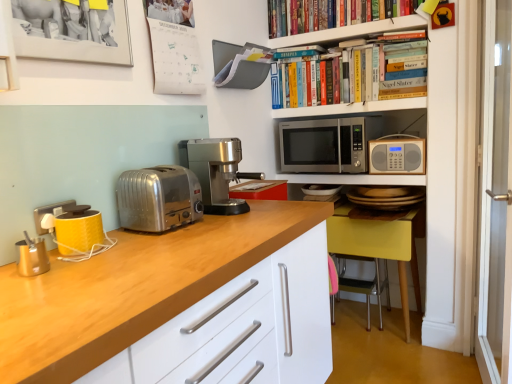
What is the approximate width of stainless steel microwave at upper center?

It is 20.81 inches.

Measure the distance between hardcover books at upper center, positioned as the second shelf in bottom-to-top order, and camera.

They are 2.14 meters apart.

What do you see at coordinates (351, 108) in the screenshot?
I see `hardcover books at upper center, the 1th shelf ordered from the bottom` at bounding box center [351, 108].

You are a GUI agent. You are given a task and a screenshot of the screen. Output one action in this format:
    pyautogui.click(x=<x>, y=<y>)
    Task: Click on the matte black picture frame at upper left
    This screenshot has width=512, height=384.
    Given the screenshot: What is the action you would take?
    pyautogui.click(x=73, y=30)

Locate an element on the screen. This screenshot has width=512, height=384. yellow matte coffee machine at left, which ranks as the 1th coffee machine in left-to-right order is located at coordinates (72, 229).

At what (x,y) coordinates should I click in order to perform the action: click on transparent glass door at right. Please return your answer as a coordinate pair (x, y). Looking at the image, I should click on (495, 196).

Measure the distance between point (377, 152) and camera.

Point (377, 152) is 7.68 feet from camera.

Where is `stainless steel microwave at upper center`? The image size is (512, 384). stainless steel microwave at upper center is located at coordinates (326, 145).

Considering the sizes of objects hardcover books at upper center, the 1th shelf positioned from the top, and hardcover books at upper center in the image provided, who is shorter, hardcover books at upper center, the 1th shelf positioned from the top, or hardcover books at upper center?

Standing shorter between the two is hardcover books at upper center.

From the image's perspective, between hardcover books at upper center, the 1th shelf positioned from the top, and hardcover books at upper center, which one is located above?

hardcover books at upper center is shown above in the image.

Locate an element on the screen. The height and width of the screenshot is (384, 512). book in front of the hardcover books at upper center, positioned as the second shelf in bottom-to-top order is located at coordinates (330, 14).

Considering the relative positions of hardcover books at upper center, positioned as the second shelf in bottom-to-top order, and hardcover books at upper center in the image provided, is hardcover books at upper center, positioned as the second shelf in bottom-to-top order, behind hardcover books at upper center?

Yes, hardcover books at upper center, positioned as the second shelf in bottom-to-top order, is further from the viewer.

How different are the orientations of stainless steel microwave at upper center and polished stainless steel coffee machine at center, which appears as the second coffee machine when viewed from the front, in degrees?

89.6 degrees.

Is stainless steel microwave at upper center inside or outside of polished stainless steel coffee machine at center, the first coffee machine viewed from the back?

stainless steel microwave at upper center cannot be found inside polished stainless steel coffee machine at center, the first coffee machine viewed from the back.

Does stainless steel microwave at upper center come behind polished stainless steel coffee machine at center, which appears as the second coffee machine when viewed from the left?

Yes.

In order to click on the 1st coffee machine below the stainless steel microwave at upper center (from the image's perspective) in this screenshot , I will do (216, 172).

Is satin silver toaster at left inside hardcover books at upper center?

No, satin silver toaster at left is not surrounded by hardcover books at upper center.

How distant is hardcover books at upper center from satin silver toaster at left?

A distance of 4.73 feet exists between hardcover books at upper center and satin silver toaster at left.

Would you say hardcover books at upper center is a long distance from satin silver toaster at left?

Yes, hardcover books at upper center and satin silver toaster at left are located far from each other.

Between hardcover books at upper center and satin silver toaster at left, which one has more height?

With more height is hardcover books at upper center.

Is point (401, 92) closer to viewer compared to point (385, 219)?

Yes.

Does hardcover books at upper center, positioned as the second shelf in bottom-to-top order, have a greater width compared to yellow wood chair at lower right, the 1th chair positioned from the front?

No, hardcover books at upper center, positioned as the second shelf in bottom-to-top order, is not wider than yellow wood chair at lower right, the 1th chair positioned from the front.

Which of these two, hardcover books at upper center, the 1th shelf positioned from the top, or yellow wood chair at lower right, which is the 2th chair in back-to-front order, is bigger?

With larger size is yellow wood chair at lower right, which is the 2th chair in back-to-front order.

Is hardcover books at upper center, the 1th shelf positioned from the top, turned away from yellow wood chair at lower right, which is the 2th chair in back-to-front order?

hardcover books at upper center, the 1th shelf positioned from the top, is not turned away from yellow wood chair at lower right, which is the 2th chair in back-to-front order.

You are a GUI agent. You are given a task and a screenshot of the screen. Output one action in this format:
    pyautogui.click(x=<x>, y=<y>)
    Task: Click on the 2nd shelf above when counting from the yellow wood chair at lower right, the 1th chair positioned from the front (from the image's perspective)
    
    Given the screenshot: What is the action you would take?
    pyautogui.click(x=352, y=32)

Which object is further away from the camera, yellow wood chair at lower right, the 1th chair positioned from the front, or hardcover books at upper center, the 1th shelf positioned from the top?

yellow wood chair at lower right, the 1th chair positioned from the front, is further from the camera.

From the image's perspective, is yellow wood chair at lower right, the 1th chair positioned from the front, located above hardcover books at upper center, the 1th shelf positioned from the top?

Incorrect, from the image's perspective, yellow wood chair at lower right, the 1th chair positioned from the front, is lower than hardcover books at upper center, the 1th shelf positioned from the top.

Is yellow wood chair at lower right, which is the 2th chair in back-to-front order, inside or outside of hardcover books at upper center, positioned as the second shelf in bottom-to-top order?

yellow wood chair at lower right, which is the 2th chair in back-to-front order, is not enclosed by hardcover books at upper center, positioned as the second shelf in bottom-to-top order.

From a real-world perspective, is matte black picture frame at upper left on yellow wood chair at lower right, which is the 2th chair in back-to-front order?

Yes.

Which of these two, matte black picture frame at upper left or yellow wood chair at lower right, the 1th chair positioned from the front, stands taller?

yellow wood chair at lower right, the 1th chair positioned from the front.

Could you tell me if matte black picture frame at upper left is turned towards yellow wood chair at lower right, which is the 2th chair in back-to-front order?

No.

Measure the distance from matte black picture frame at upper left to yellow wood chair at lower right, which is the 2th chair in back-to-front order.

They are 5.26 feet apart.

Which is farther, (137,172) or (412,7)?

The point (412,7) is farther from the camera.

Considering the sizes of objects satin silver toaster at left and hardcover books at upper center in the image provided, who is bigger, satin silver toaster at left or hardcover books at upper center?

hardcover books at upper center.

Looking at this image, is satin silver toaster at left behind hardcover books at upper center?

No.

Can you tell me how much satin silver toaster at left and hardcover books at upper center differ in facing direction?

satin silver toaster at left and hardcover books at upper center are facing 90.8 degrees away from each other.

From the image's perspective, starting from the hardcover books at upper center, which shelf is the 1st one below? Please provide its 2D coordinates.

[(352, 32)]

Where is `microwave oven to the right of polished stainless steel coffee machine at center, the first coffee machine viewed from the back`? The height and width of the screenshot is (384, 512). microwave oven to the right of polished stainless steel coffee machine at center, the first coffee machine viewed from the back is located at coordinates tap(326, 145).

Looking at the image, which one is located closer to yellow fabric chair at lower right, the 1th chair positioned from the back, satin silver toaster at left or wooden radio at right?

wooden radio at right is positioned closer to the anchor yellow fabric chair at lower right, the 1th chair positioned from the back.

When comparing their distances from yellow fabric chair at lower right, the 2th chair from the front, does satin silver toaster at left or matte black picture frame at upper left seem further?

matte black picture frame at upper left lies further to yellow fabric chair at lower right, the 2th chair from the front, than the other object.

Estimate the real-world distances between objects in this image. Which object is further from polished stainless steel coffee machine at center, which ranks as the 1th coffee machine in right-to-left order, yellow fabric chair at lower right, the 2th chair from the front, or yellow matte coffee machine at left, which ranks as the 1th coffee machine in left-to-right order?

yellow fabric chair at lower right, the 2th chair from the front.

Which object lies further to the anchor point satin silver toaster at left, wooden radio at right or yellow fabric chair at lower right, the 1th chair positioned from the back?

Based on the image, yellow fabric chair at lower right, the 1th chair positioned from the back, appears to be further to satin silver toaster at left.

Looking at the image, which one is located further to matte black picture frame at upper left, hardcover books at upper center, the 1th shelf positioned from the top, or wooden radio at right?

wooden radio at right lies further to matte black picture frame at upper left than the other object.

When comparing their distances from hardcover books at upper center, the 1th shelf positioned from the top, does yellow fabric chair at lower right, the 2th chair from the front, or polished stainless steel coffee machine at center, which ranks as the 1th coffee machine in right-to-left order, seem further?

Based on the image, yellow fabric chair at lower right, the 2th chair from the front, appears to be further to hardcover books at upper center, the 1th shelf positioned from the top.

Estimate the real-world distances between objects in this image. Which object is further from hardcover books at upper center, the 1th shelf ordered from the bottom, hardcover books at upper center, the 1th shelf positioned from the top, or yellow fabric chair at lower right, the 1th chair positioned from the back?

Among the two, yellow fabric chair at lower right, the 1th chair positioned from the back, is located further to hardcover books at upper center, the 1th shelf ordered from the bottom.

Considering their positions, is matte black picture frame at upper left positioned closer to stainless steel microwave at upper center than hardcover books at upper center, the 1th shelf ordered from the bottom?

hardcover books at upper center, the 1th shelf ordered from the bottom.

The height and width of the screenshot is (384, 512). I want to click on coffee machine between matte black picture frame at upper left and satin silver toaster at left in the vertical direction, so pyautogui.click(x=216, y=172).

The height and width of the screenshot is (384, 512). What are the coordinates of `coffee machine between satin silver toaster at left and yellow wood chair at lower right, which is the 2th chair in back-to-front order, in the horizontal direction` in the screenshot? It's located at (216, 172).

Image resolution: width=512 pixels, height=384 pixels. Identify the location of appliance located between matte black picture frame at upper left and transparent glass door at right in the left-right direction. (397, 155).

Image resolution: width=512 pixels, height=384 pixels. I want to click on appliance between transparent glass door at right and yellow wood chair at lower right, the 1th chair positioned from the front, from front to back, so click(397, 155).